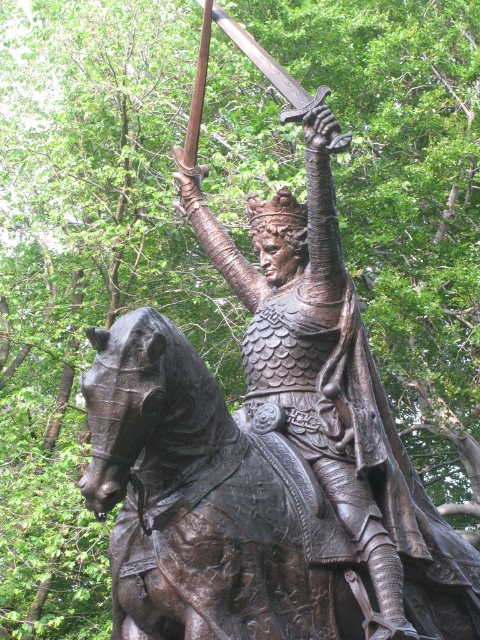
How far apart are bronze textured horse at center and polished bronze sword at upper center?

The distance of bronze textured horse at center from polished bronze sword at upper center is 10.12 meters.

Is point (219, 392) farther from viewer compared to point (204, 72)?

No, it is in front of (204, 72).

Is point (455, 596) less distant than point (186, 150)?

Yes, it is in front of point (186, 150).

Locate an element on the screen. The width and height of the screenshot is (480, 640). bronze textured horse at center is located at coordinates coord(208,504).

Is bronze armor at center wider than polished bronze sword at upper center?

In fact, bronze armor at center might be narrower than polished bronze sword at upper center.

Is bronze armor at center smaller than polished bronze sword at upper center?

Indeed, bronze armor at center has a smaller size compared to polished bronze sword at upper center.

The height and width of the screenshot is (640, 480). What do you see at coordinates (317, 362) in the screenshot?
I see `bronze armor at center` at bounding box center [317, 362].

Locate an element on the screen. bronze armor at center is located at coordinates (317, 362).

Is bronze textured horse at center smaller than bronze armor at center?

Indeed, bronze textured horse at center has a smaller size compared to bronze armor at center.

Between bronze textured horse at center and bronze armor at center, which one appears on the left side from the viewer's perspective?

bronze textured horse at center

Between point (108, 394) and point (289, 384), which one is positioned behind?

The point (289, 384) is behind.

Locate an element on the screen. The image size is (480, 640). bronze textured horse at center is located at coordinates (208, 504).